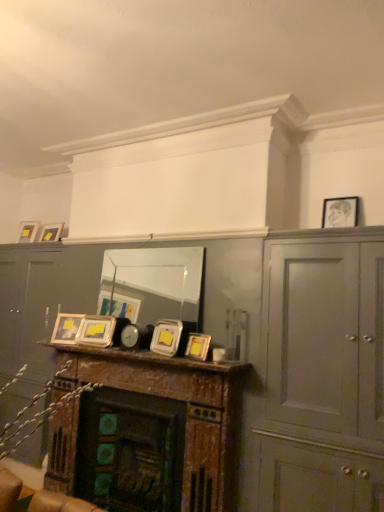
Question: From a real-world perspective, is metallic silver picture frame at center, positioned as the third picture frame in right-to-left order, on top of metallic silver frames at center?

Choices:
 (A) yes
 (B) no

Answer: (A)

Question: Is metallic silver picture frame at center, which is counted as the fourth picture frame, starting from the left, next to metallic silver frames at center?

Choices:
 (A) no
 (B) yes

Answer: (A)

Question: Is metallic silver picture frame at center, arranged as the fifth picture frame when viewed from the back, positioned far away from metallic silver frames at center?

Choices:
 (A) yes
 (B) no

Answer: (B)

Question: Could metallic silver frames at center be considered to be inside metallic silver picture frame at center, which is the fourth picture frame in bottom-to-top order?

Choices:
 (A) yes
 (B) no

Answer: (B)

Question: Is metallic silver picture frame at center, which is the fourth picture frame in bottom-to-top order, bigger than metallic silver frames at center?

Choices:
 (A) yes
 (B) no

Answer: (B)

Question: From the image's perspective, is metallic silver picture frame at center, which is the fourth picture frame in bottom-to-top order, located above metallic silver frames at center?

Choices:
 (A) no
 (B) yes

Answer: (B)

Question: From the image's perspective, would you say metallic silver picture frame at center, marked as the fourth picture frame in a right-to-left arrangement, is positioned over wooden mantel at center?

Choices:
 (A) yes
 (B) no

Answer: (A)

Question: Are metallic silver picture frame at center, the 3th picture frame from the bottom, and wooden mantel at center located far from each other?

Choices:
 (A) no
 (B) yes

Answer: (A)

Question: Is metallic silver picture frame at center, the 4th picture frame in the top-to-bottom sequence, closer to camera compared to wooden mantel at center?

Choices:
 (A) yes
 (B) no

Answer: (B)

Question: Does metallic silver picture frame at center, which appears as the third picture frame when viewed from the back, turn towards wooden mantel at center?

Choices:
 (A) no
 (B) yes

Answer: (A)

Question: From a real-world perspective, is metallic silver picture frame at center, the 4th picture frame in the top-to-bottom sequence, located beneath wooden mantel at center?

Choices:
 (A) yes
 (B) no

Answer: (B)

Question: Does metallic silver picture frame at center, marked as the 3th picture frame in a left-to-right arrangement, have a smaller size compared to wooden mantel at center?

Choices:
 (A) yes
 (B) no

Answer: (A)

Question: Is matte gold picture frame at upper left, the sixth picture frame in the right-to-left sequence, inside metallic silver frames at center?

Choices:
 (A) no
 (B) yes

Answer: (A)